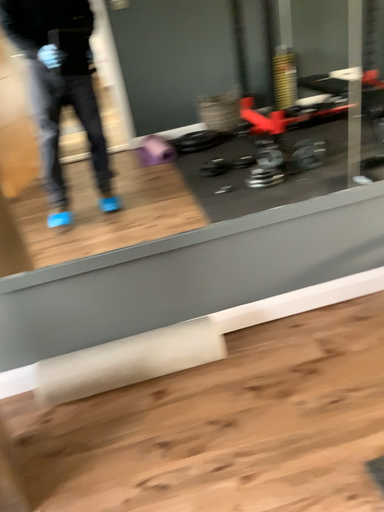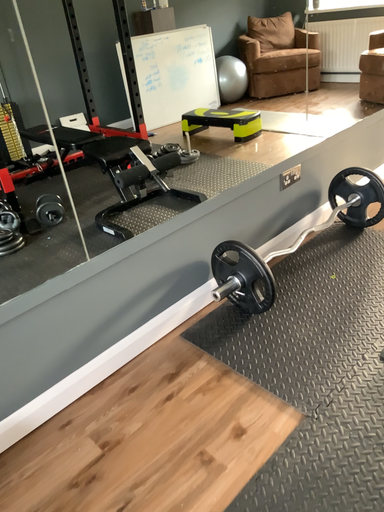
Question: Which way did the camera rotate in the video?

Choices:
 (A) rotated upward
 (B) rotated downward

Answer: (A)